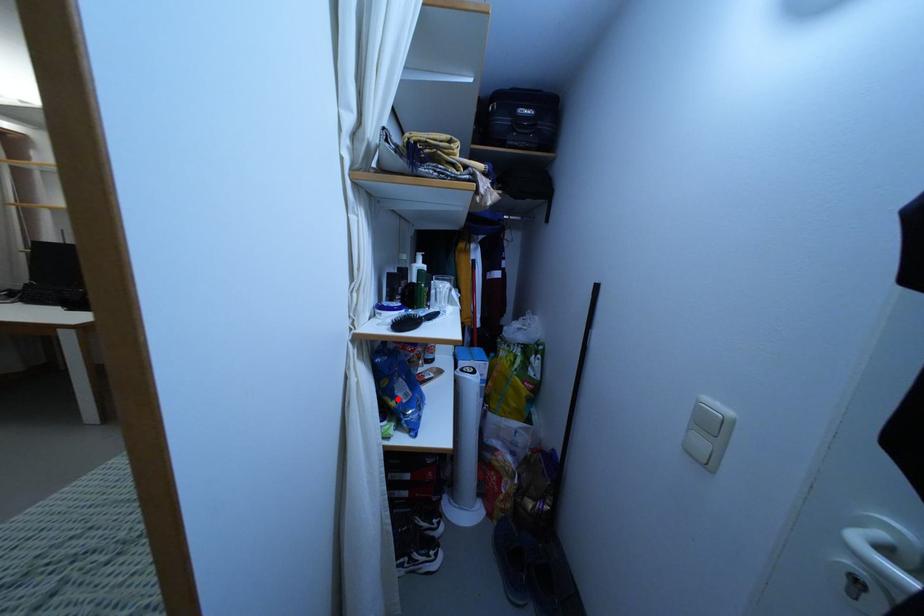
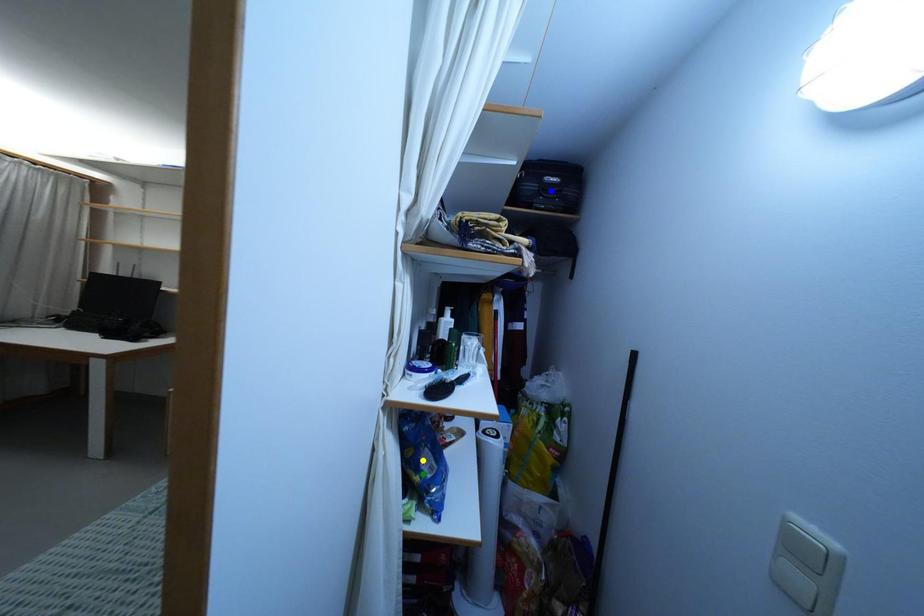
Question: I am providing you with two images of the same scene from different viewpoints. A red point is marked on the first image. You are given multiple points on the second image. Which spot in image 2 lines up with the point in image 1?

Choices:
 (A) green point
 (B) yellow point
 (C) blue point

Answer: (A)